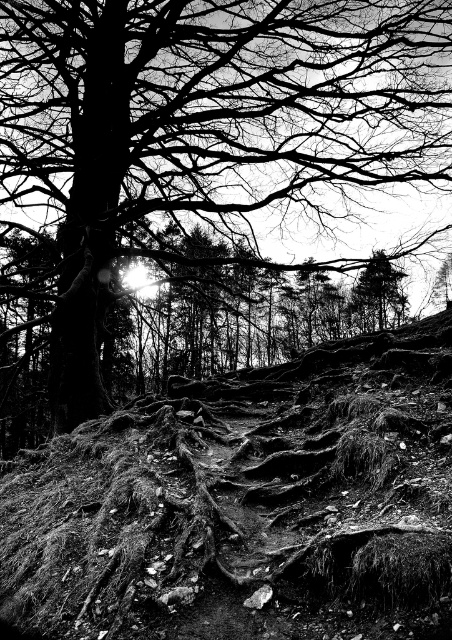
Question: Which point appears farthest from the camera in this image?

Choices:
 (A) (385, 284)
 (B) (442, 586)
 (C) (173, 192)

Answer: (C)

Question: Which of these objects is positioned farthest from the dark bark tree at upper left?

Choices:
 (A) dull earthy soil at center
 (B) smooth bark tree at upper center

Answer: (A)

Question: Estimate the real-world distances between objects in this image. Which object is closer to the smooth bark tree at upper center?

Choices:
 (A) dark bark tree at upper left
 (B) dull earthy soil at center

Answer: (A)

Question: Is dull earthy soil at center below dark bark tree at upper left?

Choices:
 (A) yes
 (B) no

Answer: (A)

Question: Can you confirm if dull earthy soil at center is positioned to the right of smooth bark tree at upper center?

Choices:
 (A) no
 (B) yes

Answer: (A)

Question: Where is dull earthy soil at center located in relation to smooth bark tree at upper center in the image?

Choices:
 (A) left
 (B) right

Answer: (A)